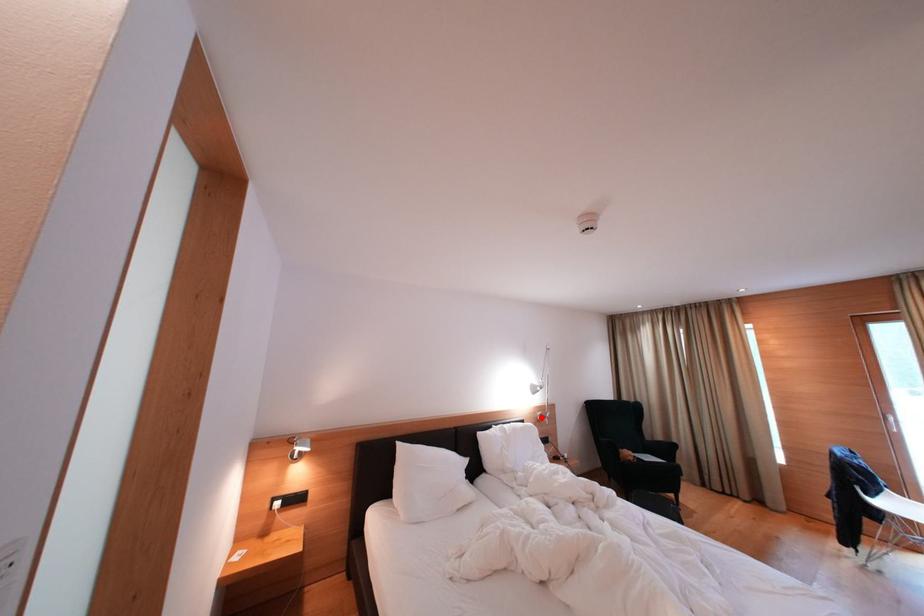
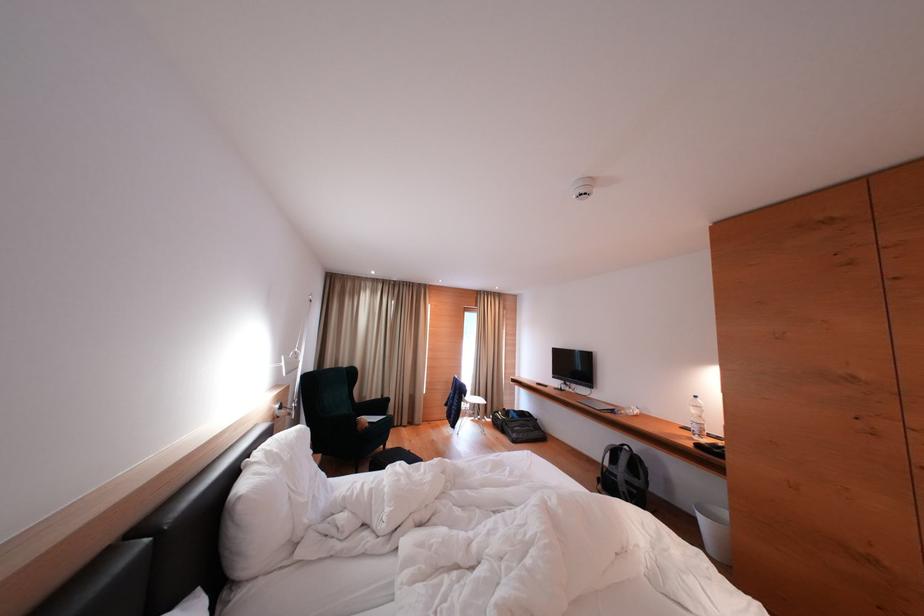
Question: A red point is marked in image1. In image2, is the corresponding 3D point closer to the camera or farther? Reply with the corresponding letter.

Choices:
 (A) The corresponding 3D point is closer.
 (B) The corresponding 3D point is farther.

Answer: (A)